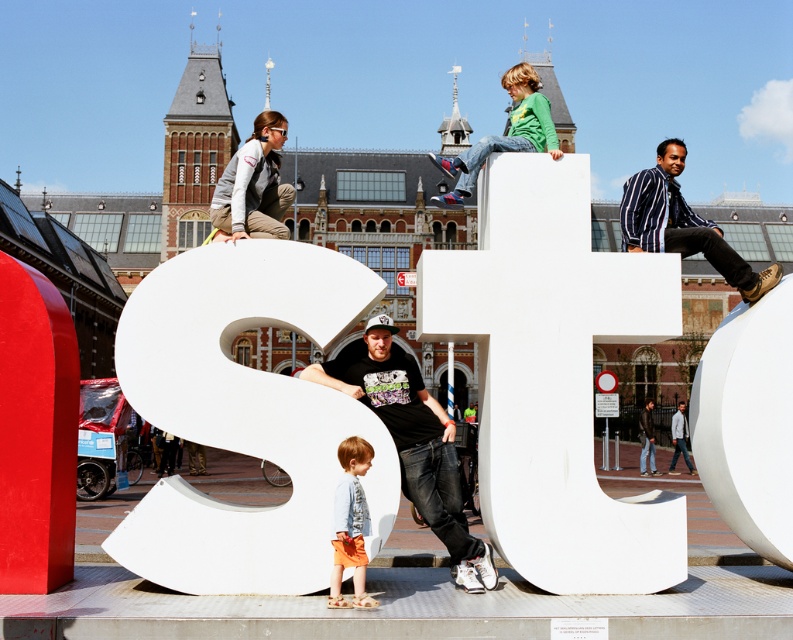
You are planning to take a photo of the light gray fabric jacket at upper left and denim jacket at lower center in the scene. The camera you are using has a maximum focus range of 50 feet. Will you be able to capture both jackets in focus without moving the camera?

The light gray fabric jacket at upper left and denim jacket at lower center are 57.62 feet apart, which exceeds the camera maximum focus range of 50 feet. Therefore, you will not be able to capture both jackets in focus without moving the camera.

You are planning to take a photo of the white matte letter t at upper center and the denim jacket at lower center. Since the letter is part of an art installation, you want to ensure the jacket is visible in the frame. Considering their sizes, which object should you focus on to include both in the photo?

The white matte letter t at upper center is larger than the denim jacket at lower center. To include both in the photo, focus on the white matte letter t at upper center as the primary subject, and position the denim jacket at lower center within the frame so that both are visible.